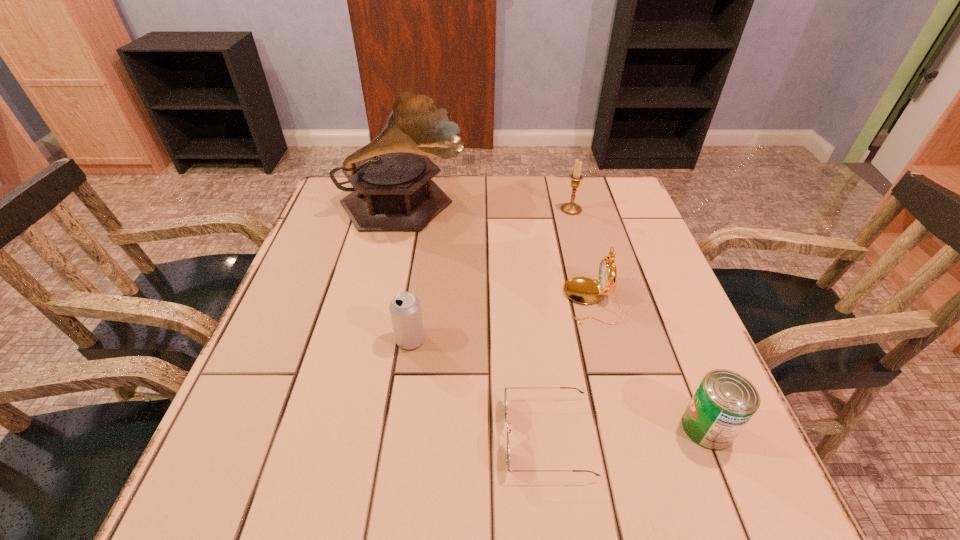
Identify the location of vacant area between the candle holder and the beer can. The image size is (960, 540). (491, 274).

Identify the location of object that stands as the second closest to the tallest object. [x=571, y=208].

Locate an element on the screen. object that stands as the second closest to the candle holder is located at coordinates (393, 190).

This screenshot has height=540, width=960. In order to click on free space that satisfies the following two spatial constraints: 1. on the horn direction of the rightmost object; 2. on the left side of the phonograph record in this screenshot , I will do `click(352, 428)`.

This screenshot has width=960, height=540. Identify the location of vacant region that satisfies the following two spatial constraints: 1. on the horn direction of the beer can; 2. on the right side of the phonograph record. (372, 340).

You are a GUI agent. You are given a task and a screenshot of the screen. Output one action in this format:
    pyautogui.click(x=<x>, y=<y>)
    Task: Click on the free spot that satisfies the following two spatial constraints: 1. on the front side of the fourth farthest object; 2. on the right side of the can
    The image size is (960, 540).
    Given the screenshot: What is the action you would take?
    pyautogui.click(x=397, y=428)

In order to click on vacant space that satisfies the following two spatial constraints: 1. on the back side of the candle holder; 2. on the right side of the beer can in this screenshot , I will do `click(429, 210)`.

Where is `free location that satisfies the following two spatial constraints: 1. on the horn direction of the tallest object; 2. on the right side of the can`? free location that satisfies the following two spatial constraints: 1. on the horn direction of the tallest object; 2. on the right side of the can is located at coordinates tap(352, 428).